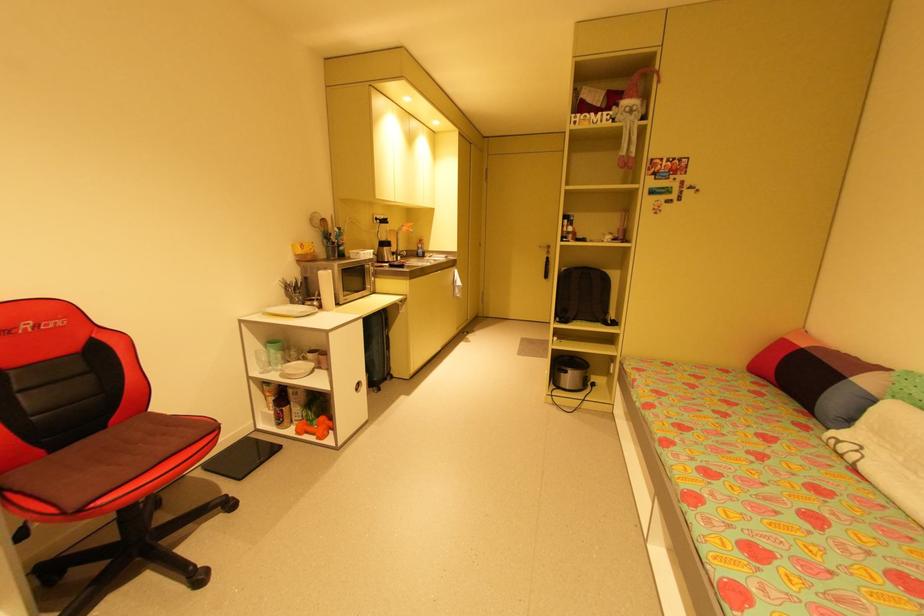
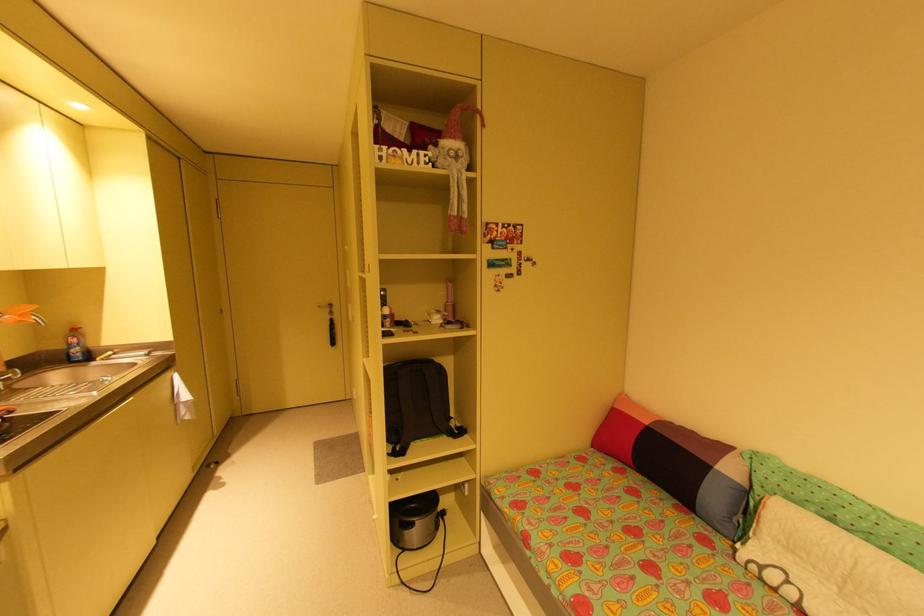
The point at [618,323] is marked in the first image. Where is the corresponding point in the second image?

(466, 431)